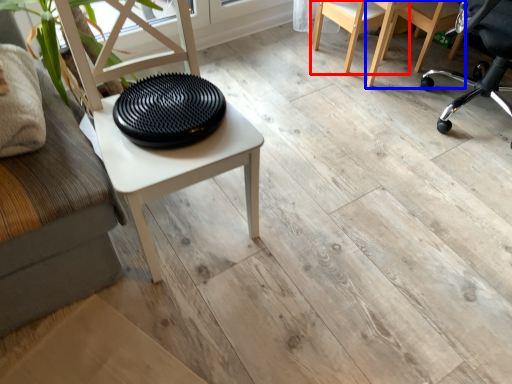
Question: Which object appears closest to the camera in this image, chair (highlighted by a red box) or chair (highlighted by a blue box)?

Choices:
 (A) chair
 (B) chair

Answer: (A)